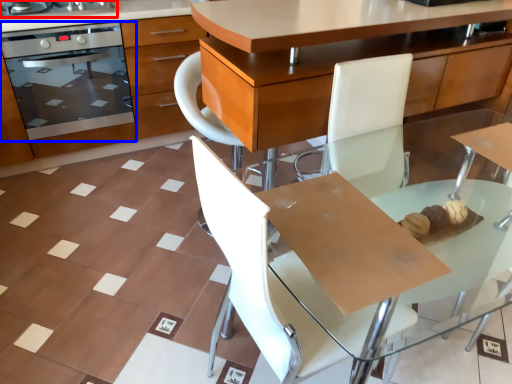
Question: Which object is closer to the camera taking this photo, home appliance (highlighted by a red box) or kitchen appliance (highlighted by a blue box)?

Choices:
 (A) home appliance
 (B) kitchen appliance

Answer: (A)